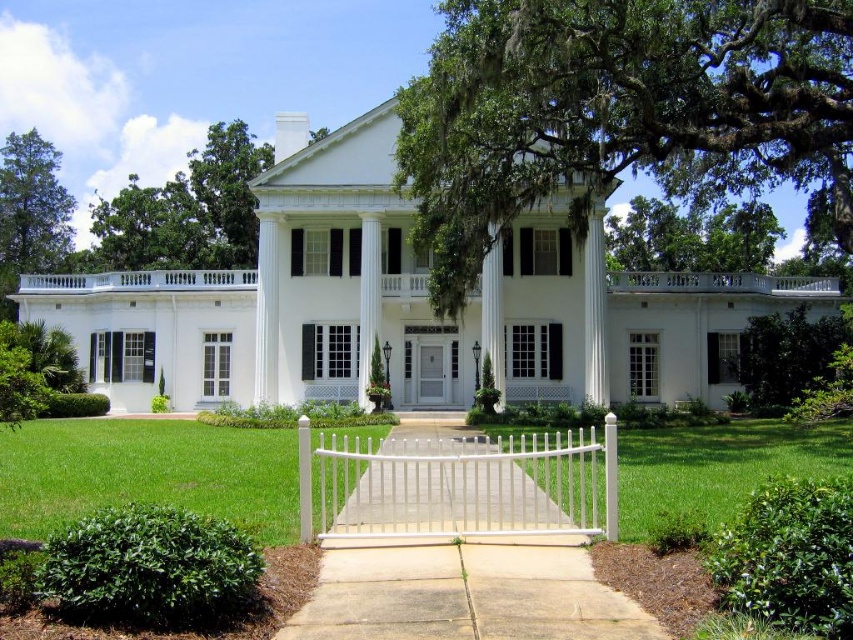
How far apart are green grass at center and white glossy column at center?

green grass at center is 42.20 feet from white glossy column at center.

Can you confirm if green grass at center is bigger than white glossy column at center?

Yes, green grass at center is bigger than white glossy column at center.

Locate an element on the screen. Image resolution: width=853 pixels, height=640 pixels. green grass at center is located at coordinates (146, 474).

Is green grass at center bigger than white vinyl gate at center?

Yes, green grass at center is bigger than white vinyl gate at center.

Does green grass at center have a greater width compared to white vinyl gate at center?

Yes, green grass at center is wider than white vinyl gate at center.

The height and width of the screenshot is (640, 853). I want to click on green grass at center, so click(x=146, y=474).

At what (x,y) coordinates should I click in order to perform the action: click on green grass at center. Please return your answer as a coordinate pair (x, y). This screenshot has height=640, width=853. Looking at the image, I should click on (146, 474).

Does white vinyl gate at center appear on the left side of white glossy column at center?

Incorrect, white vinyl gate at center is not on the left side of white glossy column at center.

Is white vinyl gate at center taller than white glossy column at center?

In fact, white vinyl gate at center may be shorter than white glossy column at center.

Between point (569, 528) and point (360, 280), which one is positioned in front?

Point (569, 528) is more forward.

You are a GUI agent. You are given a task and a screenshot of the screen. Output one action in this format:
    pyautogui.click(x=<x>, y=<y>)
    Task: Click on the white vinyl gate at center
    Image resolution: width=853 pixels, height=640 pixels.
    Given the screenshot: What is the action you would take?
    pyautogui.click(x=457, y=484)